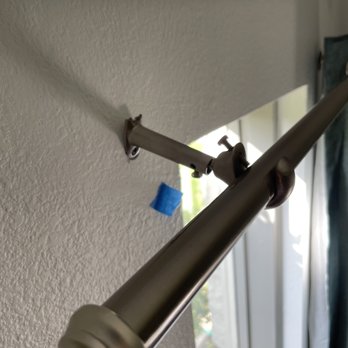
The width and height of the screenshot is (348, 348). Identify the location of right of window. (313, 203).